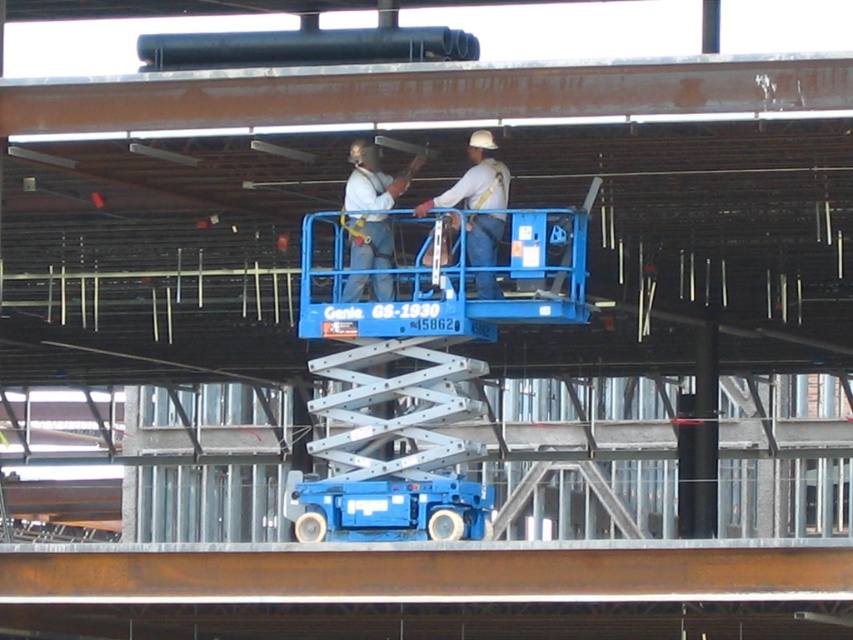
You are a safety inspector standing at the base of the construction site. You need to check if the distance between the point marked at coordinates point [384,211] and you is within the safe range of 60 meters. Is the distance safe?

The distance between point [384,211] and the viewer is 62.61 meters, which exceeds the safe range of 60 meters. Therefore, the distance is not safe.